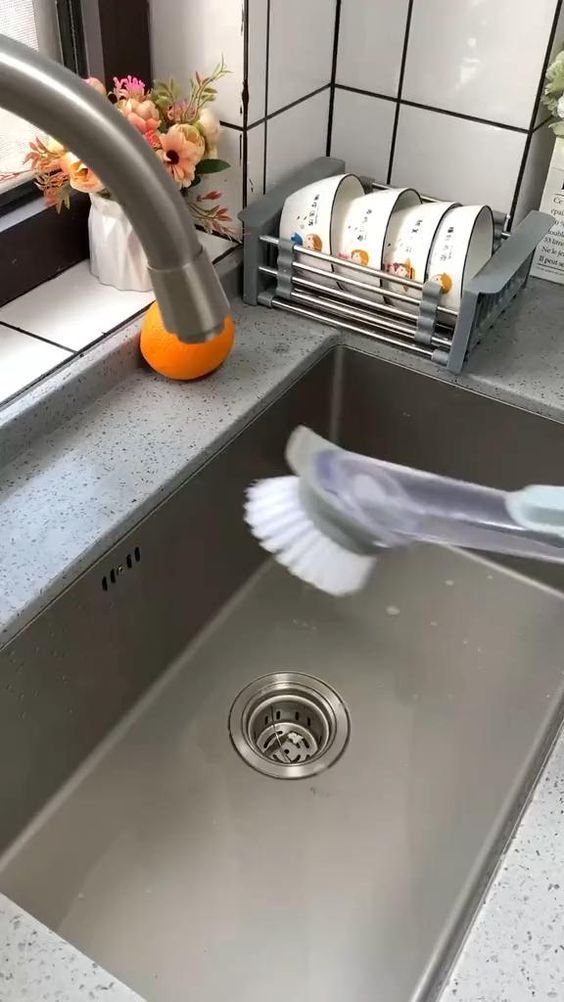
Locate an element on the screen. This screenshot has width=564, height=1002. tile is located at coordinates (491, 59).